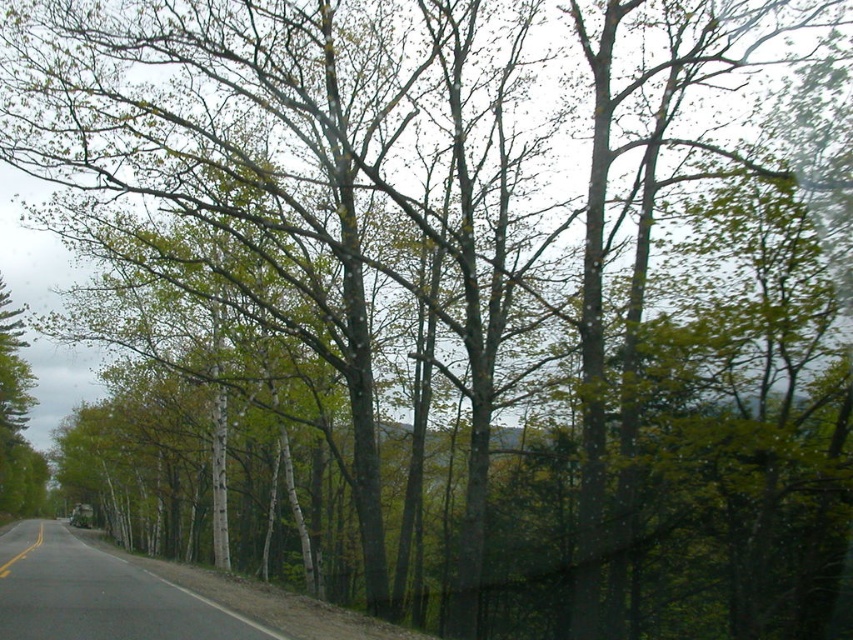
From the picture: You are a driver approaching the road with the green matte tree at left and the yellow painted line at road center. Which object will appear closer to you as you drive forward?

The green matte tree at left will appear closer because it has a larger size compared to the yellow painted line at road center, indicating it is nearer in the scene.

You are a pedestrian standing on the side of the road and want to cross to the opposite side. There is a green matte tree at left and a yellow painted line at road center. Which object is closer to your current position?

The green matte tree at left is closer to your current position because it is located to the left of the yellow painted line at road center, meaning it is nearer to the roadside where you are standing.

You are standing at the point marked as point [16,419]. Looking towards the road, which direction should you turn to face the green matte tree at left?

You should turn to your left to face the green matte tree at left, as it is located to the left side of the road from your current position at point [16,419].